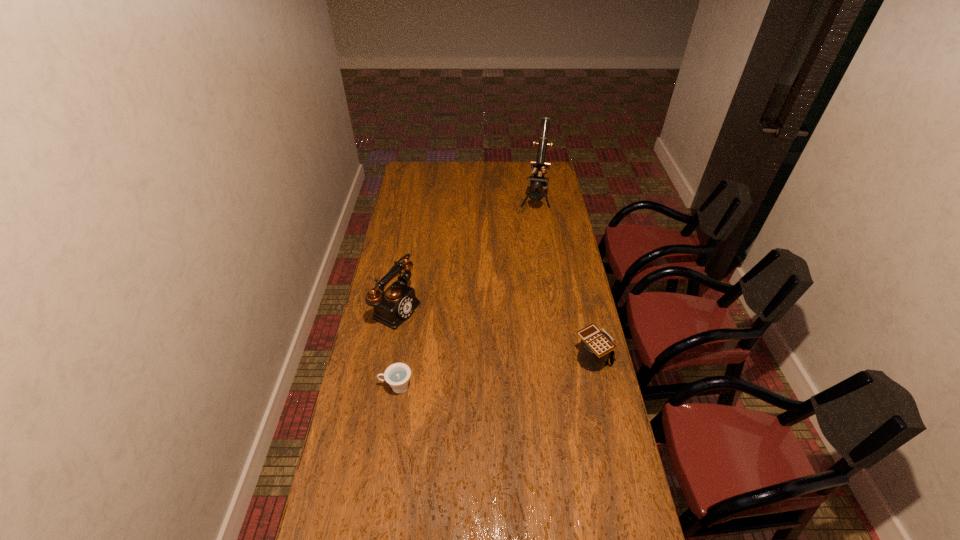
Locate an element on the screen. The image size is (960, 540). teacup is located at coordinates (397, 375).

Identify the location of the third tallest object. The height and width of the screenshot is (540, 960). (596, 347).

Locate an element on the screen. This screenshot has height=540, width=960. the farthest object is located at coordinates (540, 165).

The height and width of the screenshot is (540, 960). Identify the location of the tallest object. (540, 165).

Where is `the third nearest object`? This screenshot has height=540, width=960. the third nearest object is located at coordinates (391, 307).

This screenshot has height=540, width=960. Find the location of `telephone`. telephone is located at coordinates (391, 307).

Locate an element on the screen. This screenshot has height=540, width=960. vacant space located 0.050m on the side of the shortest object with the handle is located at coordinates (366, 387).

You are a GUI agent. You are given a task and a screenshot of the screen. Output one action in this format:
    pyautogui.click(x=<x>, y=<y>)
    Task: Click on the vacant space situated on the side of the shortest object with the handle
    Image resolution: width=960 pixels, height=540 pixels.
    Given the screenshot: What is the action you would take?
    pyautogui.click(x=354, y=387)

Find the location of `blank space located 0.180m on the left of the second shortest object`. blank space located 0.180m on the left of the second shortest object is located at coordinates (524, 359).

The height and width of the screenshot is (540, 960). In order to click on vacant space located through the eyepiece of the microscope in this screenshot , I will do `click(527, 249)`.